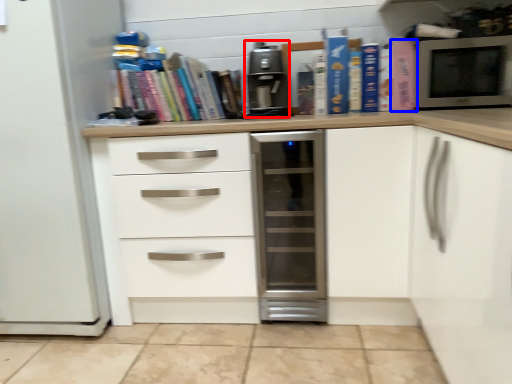
Question: Which point is further to the camera, coffee machine (highlighted by a red box) or paperback book (highlighted by a blue box)?

Choices:
 (A) coffee machine
 (B) paperback book

Answer: (B)